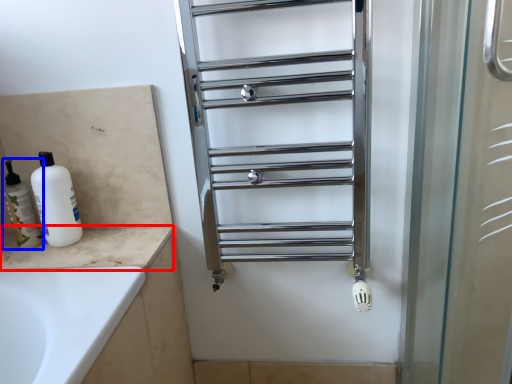
Question: Which of the following is the closest to the observer, counter top (highlighted by a red box) or toiletry (highlighted by a blue box)?

Choices:
 (A) counter top
 (B) toiletry

Answer: (A)